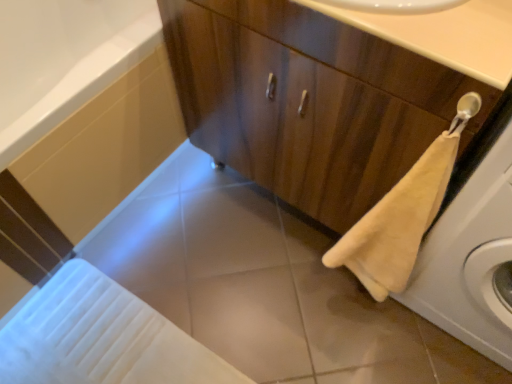
Question: Considering the positions of smooth beige countertop at upper center and beige fabric washing machine at right in the image, is smooth beige countertop at upper center wider or thinner than beige fabric washing machine at right?

Choices:
 (A) thin
 (B) wide

Answer: (A)

Question: Considering the positions of smooth beige countertop at upper center and beige fabric washing machine at right in the image, is smooth beige countertop at upper center taller or shorter than beige fabric washing machine at right?

Choices:
 (A) short
 (B) tall

Answer: (A)

Question: Considering the real-world distances, which object is closest to the smooth beige countertop at upper center?

Choices:
 (A) wooden cabinet at center
 (B) beige plush towel at lower right
 (C) beige fabric washing machine at right
 (D) white glossy bath at lower left
 (E) white glossy tile at center

Answer: (A)

Question: Which object is the closest to the white glossy bath at lower left?

Choices:
 (A) wooden cabinet at center
 (B) beige plush towel at lower right
 (C) beige fabric washing machine at right
 (D) smooth beige countertop at upper center
 (E) white glossy tile at center

Answer: (A)